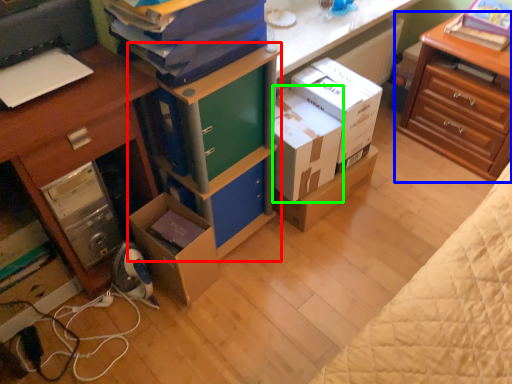
Question: Considering the real-world distances, which object is farthest from bookshelf (highlighted by a red box)? nightstand (highlighted by a blue box) or box (highlighted by a green box)?

Choices:
 (A) nightstand
 (B) box

Answer: (A)